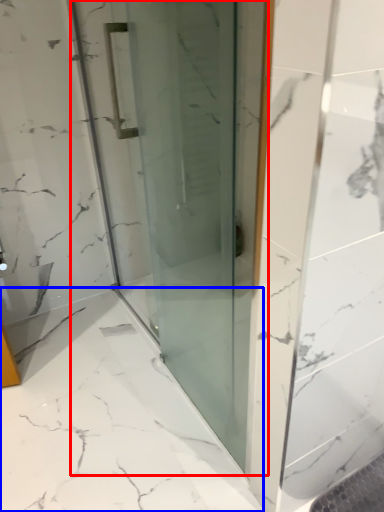
Question: Which of the following is the farthest to the observer, door (highlighted by a red box) or bath (highlighted by a blue box)?

Choices:
 (A) door
 (B) bath

Answer: (B)